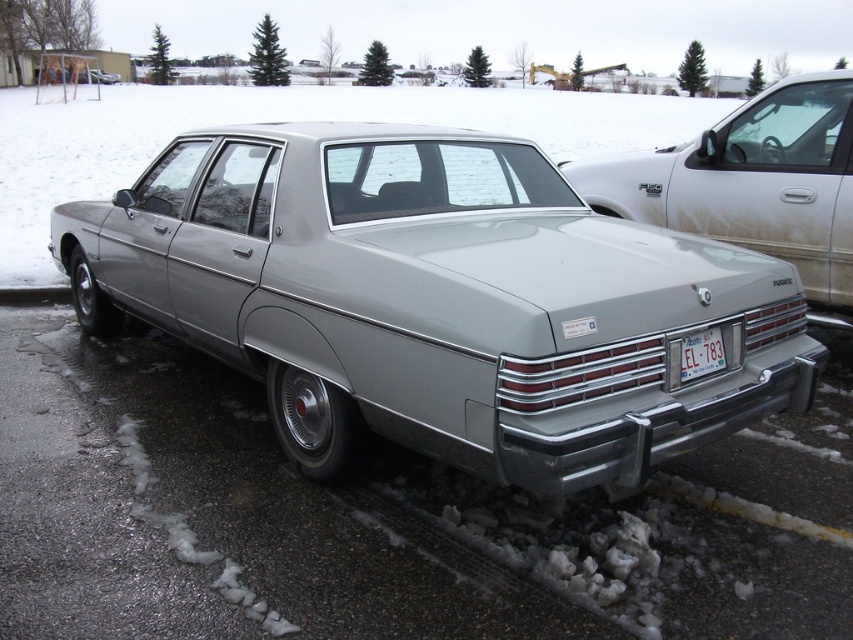
Question: Which point is closer to the camera?

Choices:
 (A) (113, 484)
 (B) (612, 225)
 (C) (770, 212)

Answer: (A)

Question: Is silver metallic sedan at center behind white plastic license plate at lower center?

Choices:
 (A) no
 (B) yes

Answer: (B)

Question: Is silver metallic sedan at center closer to camera compared to white plastic license plate at lower center?

Choices:
 (A) yes
 (B) no

Answer: (B)

Question: Which of the following is the farthest from the observer?

Choices:
 (A) metallic gray car at center
 (B) white plastic license plate at lower center
 (C) silver metallic sedan at center
 (D) satin silver sedan at center

Answer: (C)

Question: Does silver metallic sedan at center have a larger size compared to white plastic license plate at lower center?

Choices:
 (A) no
 (B) yes

Answer: (B)

Question: Estimate the real-world distances between objects in this image. Which object is closer to the silver metallic sedan at center?

Choices:
 (A) metallic gray car at center
 (B) white plastic license plate at lower center
 (C) satin silver sedan at center

Answer: (B)